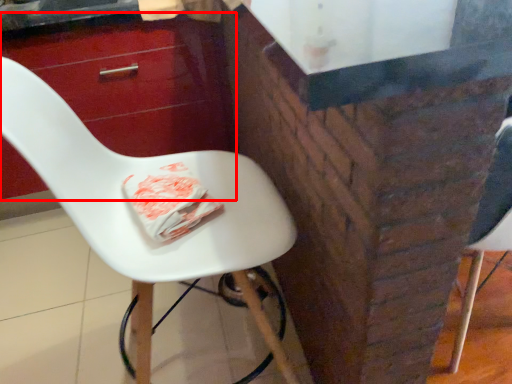
Question: From the image's perspective, where is drawer (annotated by the red box) located relative to chair?

Choices:
 (A) above
 (B) below

Answer: (A)